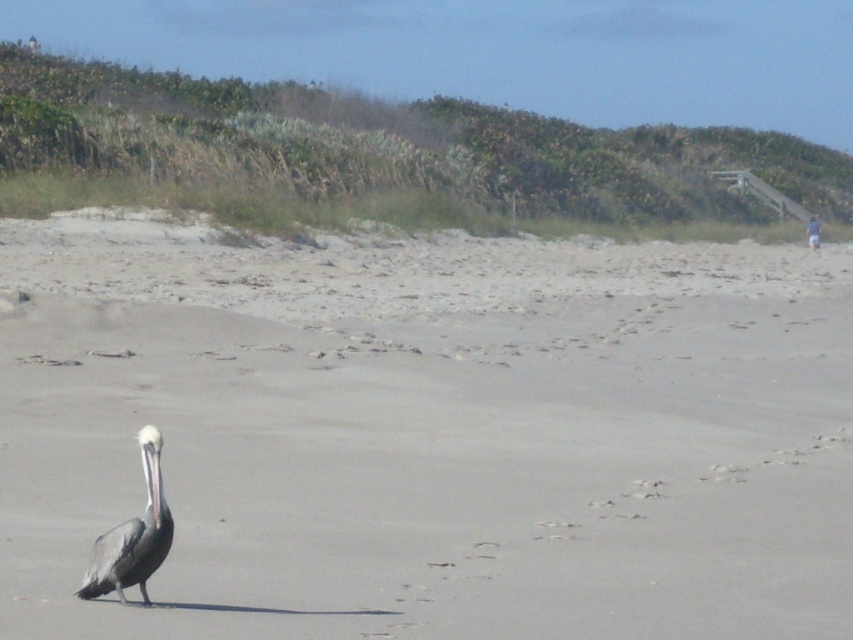
Consider the image. You are a photographer trying to capture the gray matte pelican at lower left and the gray sand at center in the same frame. Based on their positions, which object is located to the right of the other?

The gray sand at center is positioned on the right side of the gray matte pelican at lower left.

In the scene shown: You are a bird flying over the beach and want to land on the gray sand at center. Based on the coordinates provided, can you confirm if the gray sand at center is exactly at point (427,435)?

Yes, the gray sand at center is exactly located at point (427,435) as stated in the description.